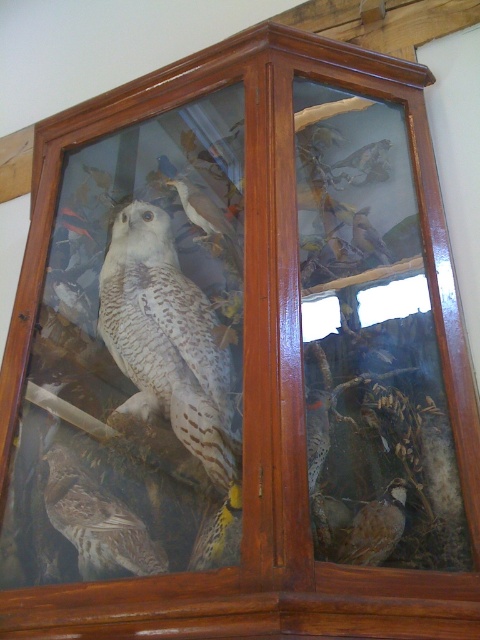
You are an interior designer assessing the display cabinet. You need to determine if the speckled white owl at center can be placed above the brown speckled feathers at lower right without blocking their view. Based on their sizes, is this arrangement feasible?

The speckled white owl at center is taller than the brown speckled feathers at lower right. Placing the owl above the feathers would block their view since the owl is taller and positioned higher up.